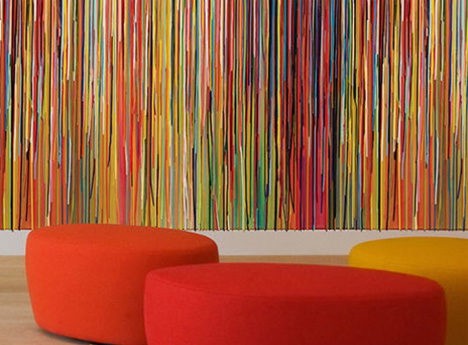
Find the location of a particular element. The width and height of the screenshot is (468, 345). top of orange ottoman is located at coordinates (111, 239).